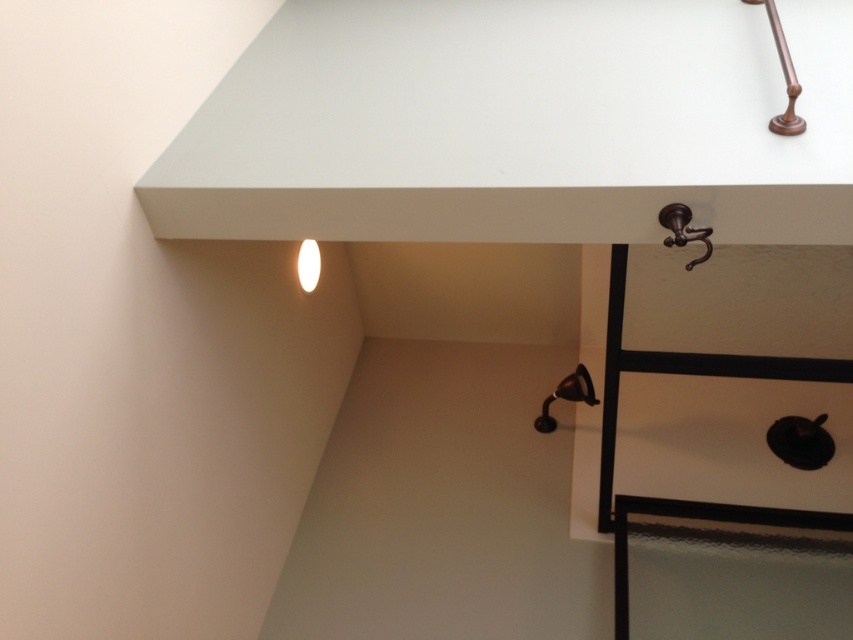
Is matte black lamp at center above white glossy lamp at center?

No.

Which is behind, point (579, 396) or point (303, 257)?

Point (579, 396)

Locate an element on the screen. This screenshot has height=640, width=853. matte black lamp at center is located at coordinates (566, 396).

Which is below, white matte countertop at upper center or copper polished faucet at upper right?

Positioned lower is white matte countertop at upper center.

Can you confirm if white matte countertop at upper center is taller than copper polished faucet at upper right?

Yes, white matte countertop at upper center is taller than copper polished faucet at upper right.

What do you see at coordinates (517, 124) in the screenshot? The width and height of the screenshot is (853, 640). I see `white matte countertop at upper center` at bounding box center [517, 124].

Locate an element on the screen. Image resolution: width=853 pixels, height=640 pixels. white matte countertop at upper center is located at coordinates (517, 124).

How distant is copper polished faucet at upper right from matte black lamp at center?

They are 4.01 feet apart.

Which is behind, point (788, 76) or point (590, 387)?

The point (590, 387) is more distant.

The width and height of the screenshot is (853, 640). What are the coordinates of `copper polished faucet at upper right` in the screenshot? It's located at (782, 76).

Locate an element on the screen. The image size is (853, 640). copper polished faucet at upper right is located at coordinates (782, 76).